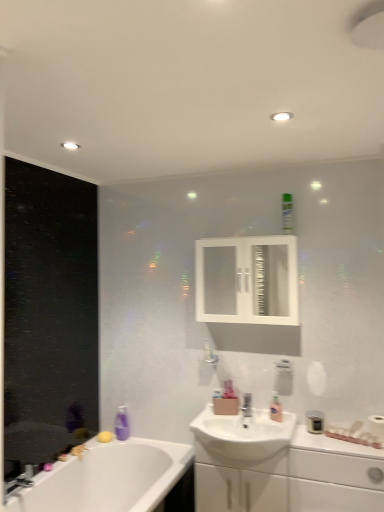
At what (x,y) coordinates should I click in order to perform the action: click on vacant area situated below white glossy medicine cabinet at upper center (from a real-world perspective). Please return your answer as a coordinate pair (x, y). This screenshot has width=384, height=512. Looking at the image, I should click on (261, 412).